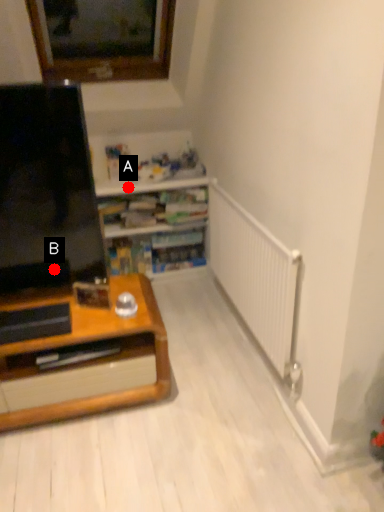
Question: Two points are circled on the image, labeled by A and B beside each circle. Among these points, which one is farthest from the camera?

Choices:
 (A) A is further
 (B) B is further

Answer: (A)